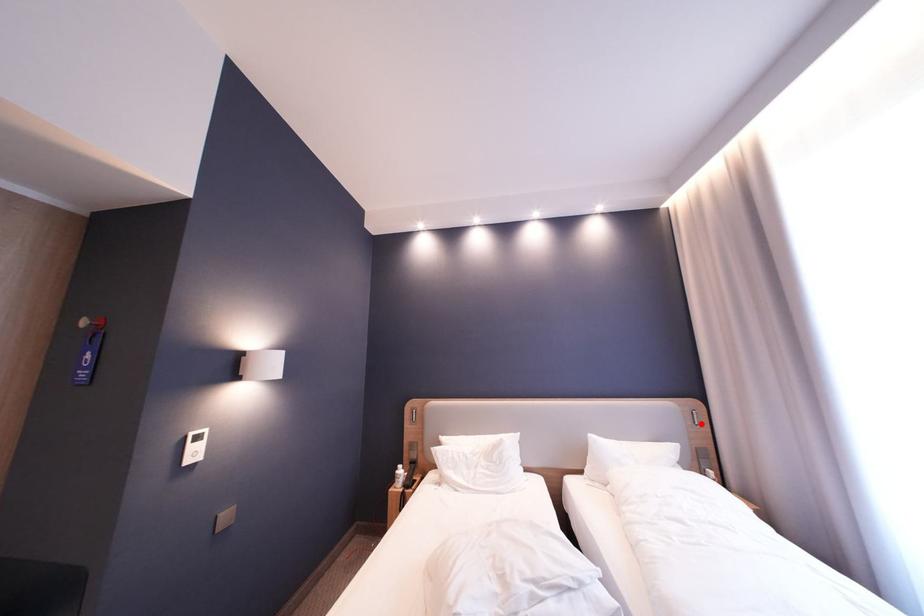
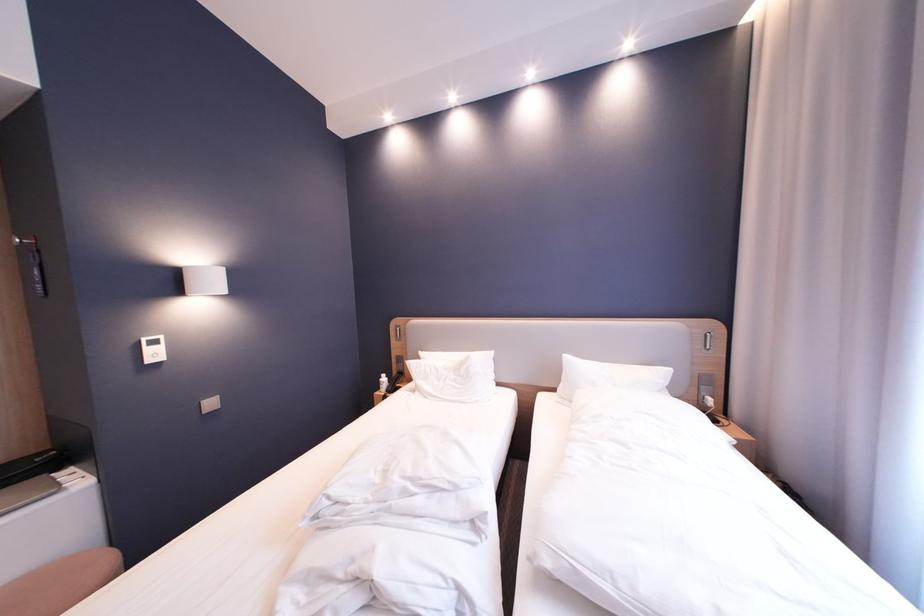
Where in the second image is the point corresponding to the highlighted location from the first image?

(711, 347)